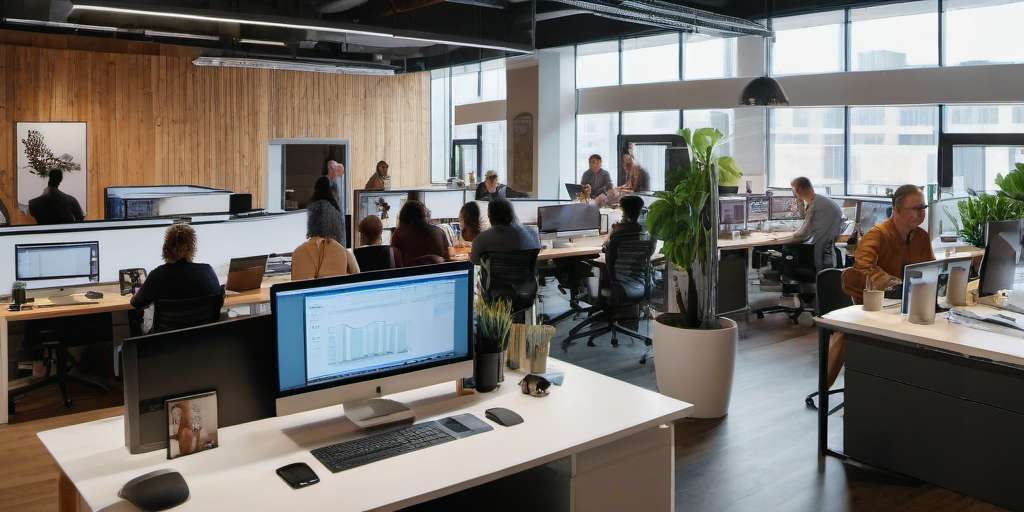
Where is `chairs`? The image size is (1024, 512). chairs is located at coordinates (816, 303), (796, 274), (612, 312), (574, 278), (516, 309).